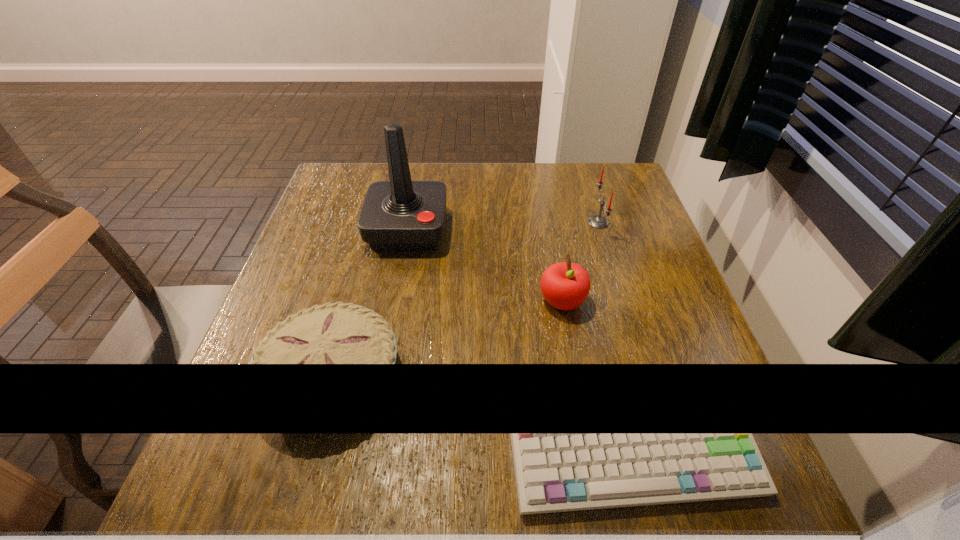
At what (x,y) coordinates should I click in order to perform the action: click on the tallest object. Please return your answer as a coordinate pair (x, y). This screenshot has height=540, width=960. Looking at the image, I should click on (398, 215).

Image resolution: width=960 pixels, height=540 pixels. I want to click on candle, so click(x=597, y=221).

What are the coordinates of `the third farthest object` in the screenshot? It's located at (565, 285).

Locate an element on the screen. This screenshot has width=960, height=540. the second object from right to left is located at coordinates (565, 285).

Find the location of a particular element. the shortest object is located at coordinates (339, 333).

The image size is (960, 540). Find the location of `the nearest object`. the nearest object is located at coordinates (339, 333).

Locate an element on the screen. The height and width of the screenshot is (540, 960). vacant position located on the left of the joystick is located at coordinates (320, 230).

I want to click on vacant space situated 0.370m on the front-facing side of the rightmost object, so click(441, 222).

Where is `free space located 0.350m on the front-facing side of the rightmost object`? This screenshot has width=960, height=540. free space located 0.350m on the front-facing side of the rightmost object is located at coordinates (448, 222).

You are a GUI agent. You are given a task and a screenshot of the screen. Output one action in this format:
    pyautogui.click(x=<x>, y=<y>)
    Task: Click on the blank area located 0.320m on the front-facing side of the rightmost object
    This screenshot has width=960, height=540.
    Given the screenshot: What is the action you would take?
    pyautogui.click(x=461, y=222)